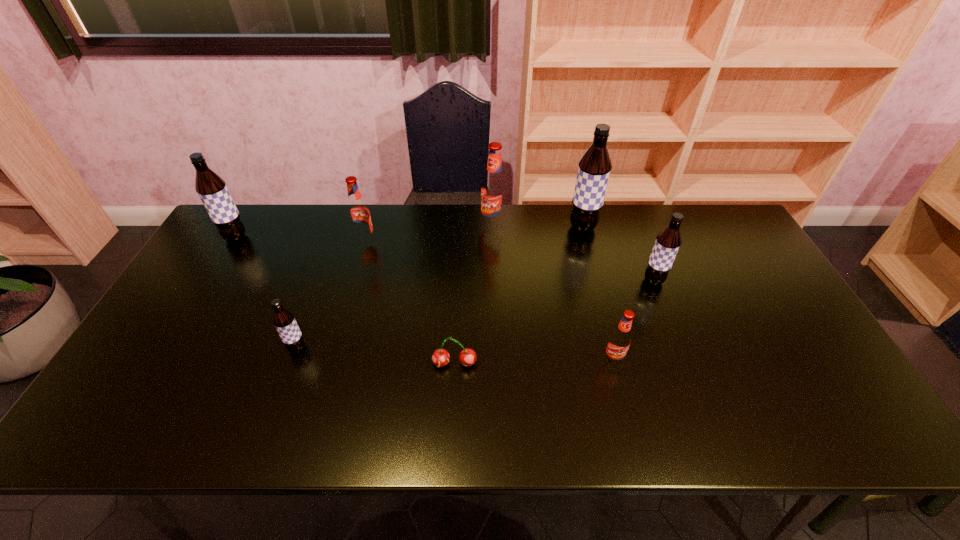
Locate an element on the screen. Image resolution: width=960 pixels, height=540 pixels. blank space located on the right of the rightmost root beer is located at coordinates (739, 280).

At what (x,y) coordinates should I click in order to perform the action: click on vacant position located 0.360m on the right of the nearest red root beer. Please return your answer as a coordinate pair (x, y). This screenshot has height=540, width=960. Looking at the image, I should click on click(x=765, y=360).

The height and width of the screenshot is (540, 960). In order to click on free space located 0.350m on the left of the smallest brown root beer in this screenshot , I will do `click(152, 349)`.

The image size is (960, 540). I want to click on free space located with stems pointing upwards on the cherry, so click(x=452, y=413).

What are the coordinates of `object that is at the left edge` in the screenshot? It's located at (211, 188).

This screenshot has height=540, width=960. I want to click on object situated at the far left corner, so click(x=211, y=188).

I want to click on vacant space at the far edge of the desktop, so click(x=471, y=225).

The height and width of the screenshot is (540, 960). What are the coordinates of `vacant space at the near edge of the desktop` in the screenshot? It's located at (541, 421).

This screenshot has width=960, height=540. Identify the location of free space at the left edge. (252, 263).

Locate an element on the screen. This screenshot has height=540, width=960. free spot at the right edge of the desktop is located at coordinates (745, 305).